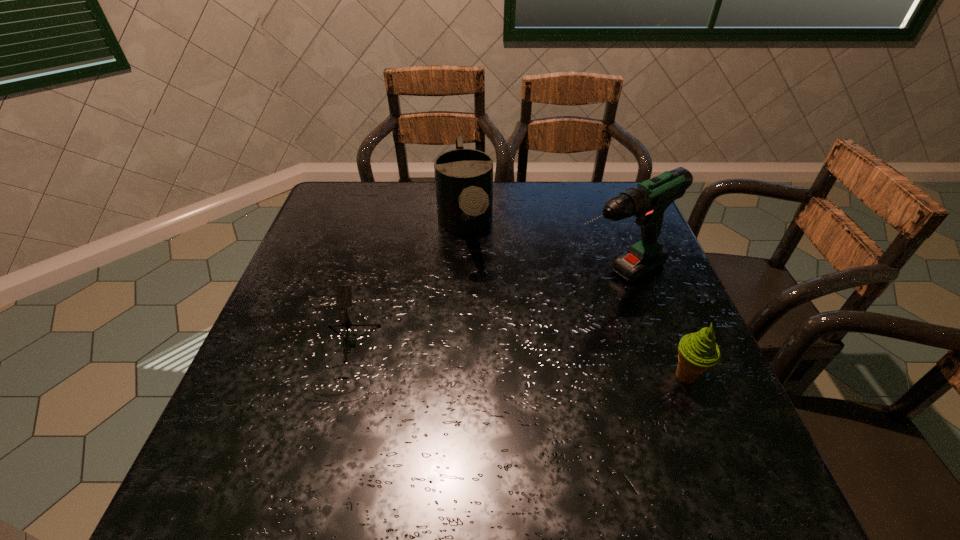
In order to click on vacant point at the far edge in this screenshot , I will do `click(557, 206)`.

Where is `free space at the near edge of the desktop`? free space at the near edge of the desktop is located at coordinates (604, 418).

This screenshot has width=960, height=540. I want to click on free space at the left edge of the desktop, so click(x=275, y=387).

You are a GUI agent. You are given a task and a screenshot of the screen. Output one action in this format:
    pyautogui.click(x=<x>, y=<y>)
    Task: Click on the free space at the right edge of the desktop
    The height and width of the screenshot is (540, 960).
    Given the screenshot: What is the action you would take?
    pyautogui.click(x=591, y=226)

Where is `vacant space at the far left corner of the desktop`? The height and width of the screenshot is (540, 960). vacant space at the far left corner of the desktop is located at coordinates (357, 221).

This screenshot has width=960, height=540. In the image, there is a desktop. Find the location of `free space at the near left corner`. free space at the near left corner is located at coordinates (219, 436).

In the image, there is a desktop. Where is `vacant space at the far right corner`? This screenshot has width=960, height=540. vacant space at the far right corner is located at coordinates (591, 203).

This screenshot has height=540, width=960. I want to click on free space between the third shortest object and the icecream, so point(575,301).

Locate an element on the screen. vacant space that's between the third tallest object and the drill is located at coordinates (651, 327).

Locate an element on the screen. vacant area between the second shortest object and the drill is located at coordinates (651, 327).